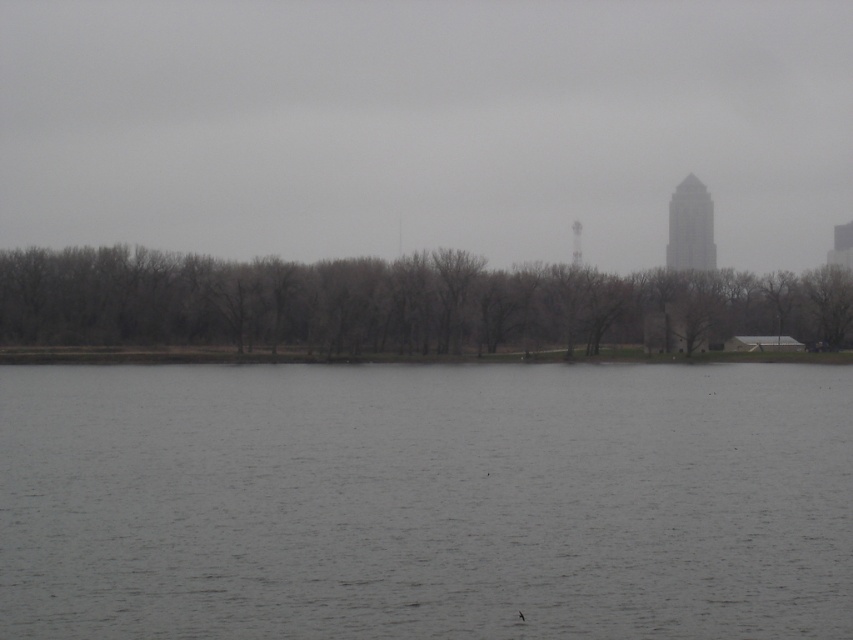
Question: Among these objects, which one is farthest from the camera?

Choices:
 (A) gray water at center
 (B) brown/dry wood trees at center

Answer: (B)

Question: From the image, what is the correct spatial relationship of gray water at center in relation to brown/dry wood trees at center?

Choices:
 (A) below
 (B) above

Answer: (A)

Question: Which object is farther from the camera taking this photo?

Choices:
 (A) gray water at center
 (B) brown/dry wood trees at center

Answer: (B)

Question: Is gray water at center bigger than brown/dry wood trees at center?

Choices:
 (A) no
 (B) yes

Answer: (A)

Question: Is the position of gray water at center more distant than that of brown/dry wood trees at center?

Choices:
 (A) yes
 (B) no

Answer: (B)